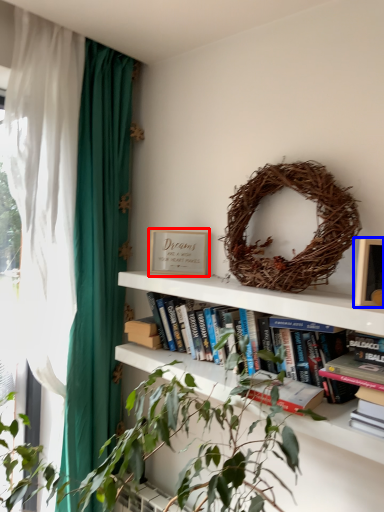
Question: Which point is closer to the camera, paperback book (highlighted by a red box) or picture frame (highlighted by a blue box)?

Choices:
 (A) paperback book
 (B) picture frame

Answer: (B)